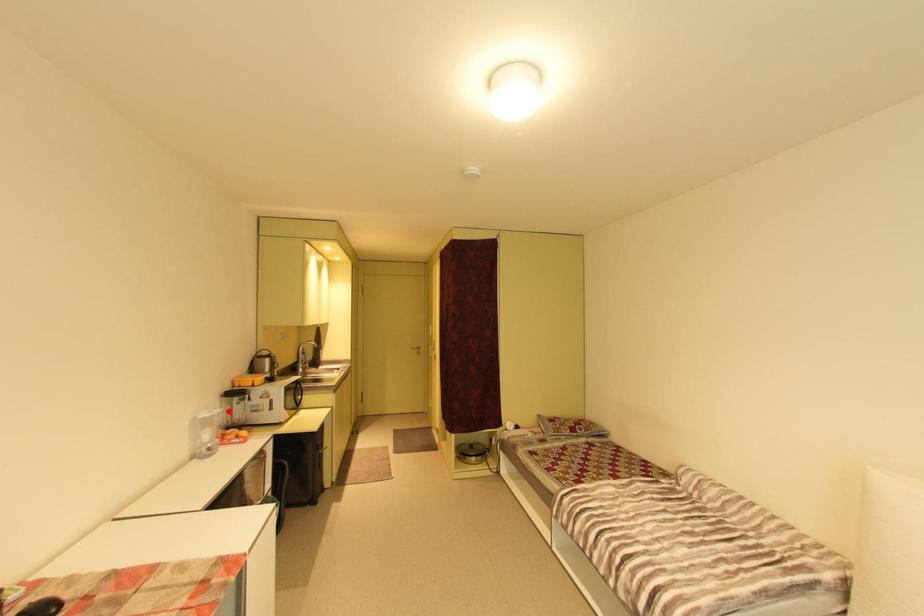
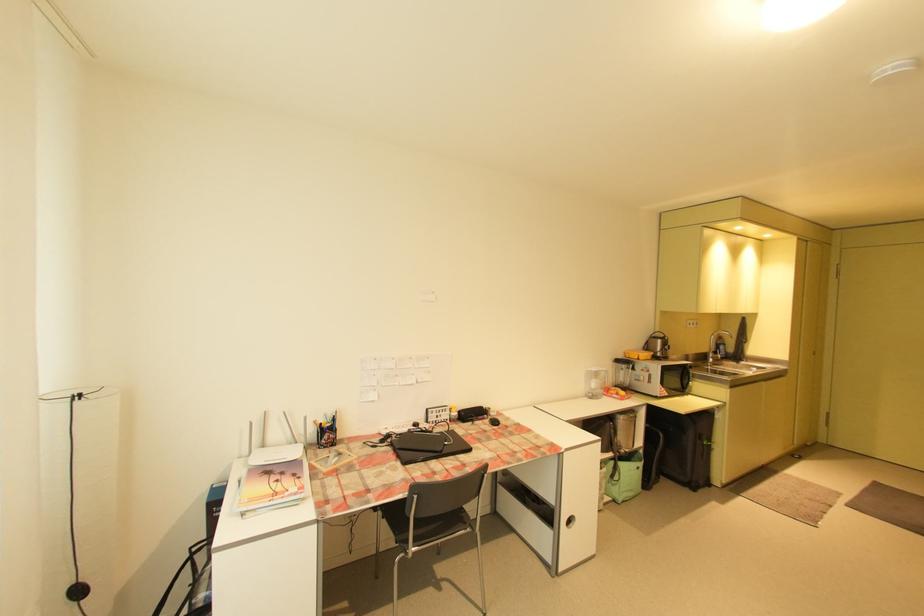
In the second image, find the point that corresponds to the highlighted location in the first image.

(613, 371)